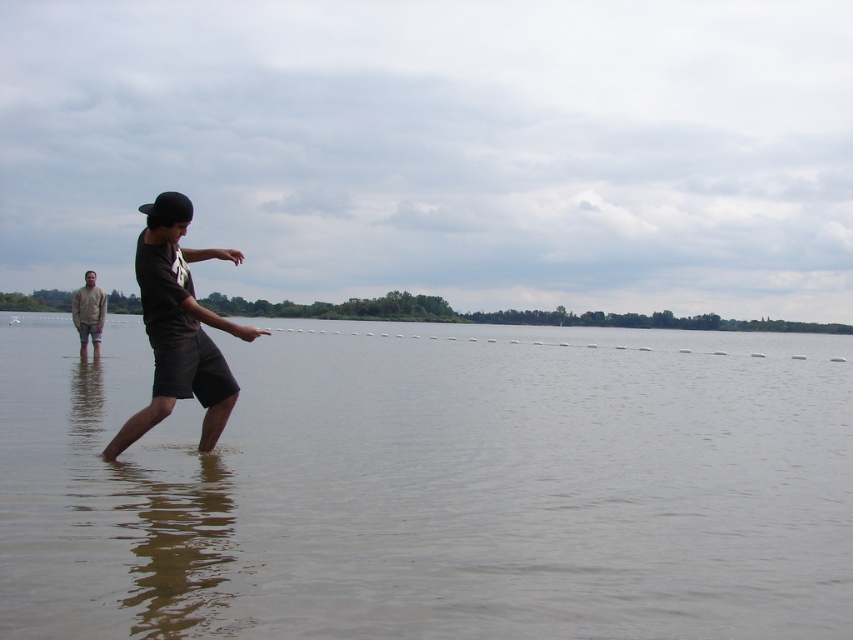
Question: Can you confirm if clear water at center is positioned above dark gray cotton shorts at center?

Choices:
 (A) yes
 (B) no

Answer: (B)

Question: Among these objects, which one is nearest to the camera?

Choices:
 (A) dark gray cotton shorts at center
 (B) light brown cotton shirt at left
 (C) clear water at center

Answer: (C)

Question: Is clear water at center above dark gray cotton shorts at center?

Choices:
 (A) yes
 (B) no

Answer: (B)

Question: Does clear water at center have a greater width compared to light brown cotton shirt at left?

Choices:
 (A) yes
 (B) no

Answer: (A)

Question: Which object is positioned closest to the light brown cotton shirt at left?

Choices:
 (A) clear water at center
 (B) dark gray cotton shorts at center

Answer: (B)

Question: Based on their relative distances, which object is nearer to the clear water at center?

Choices:
 (A) light brown cotton shirt at left
 (B) dark gray cotton shorts at center

Answer: (B)